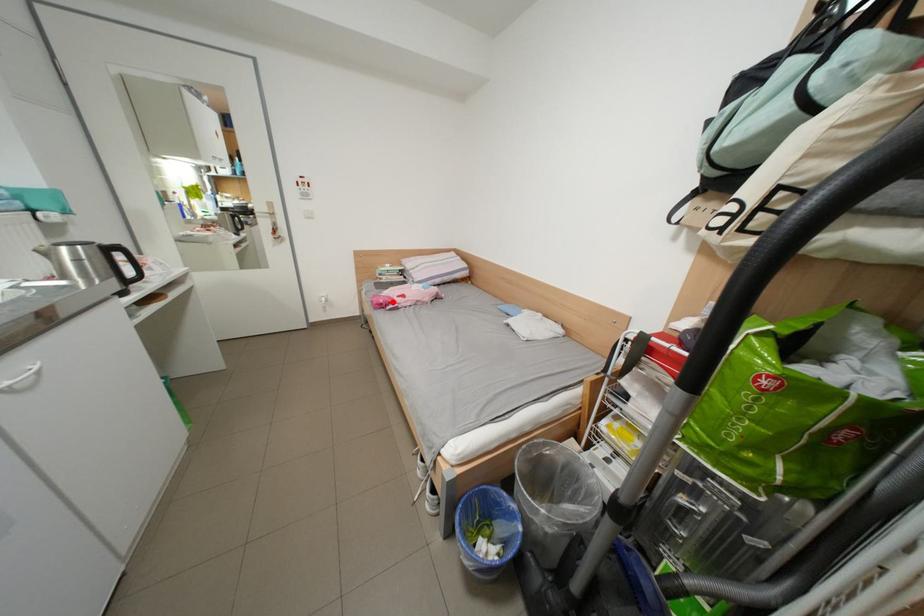
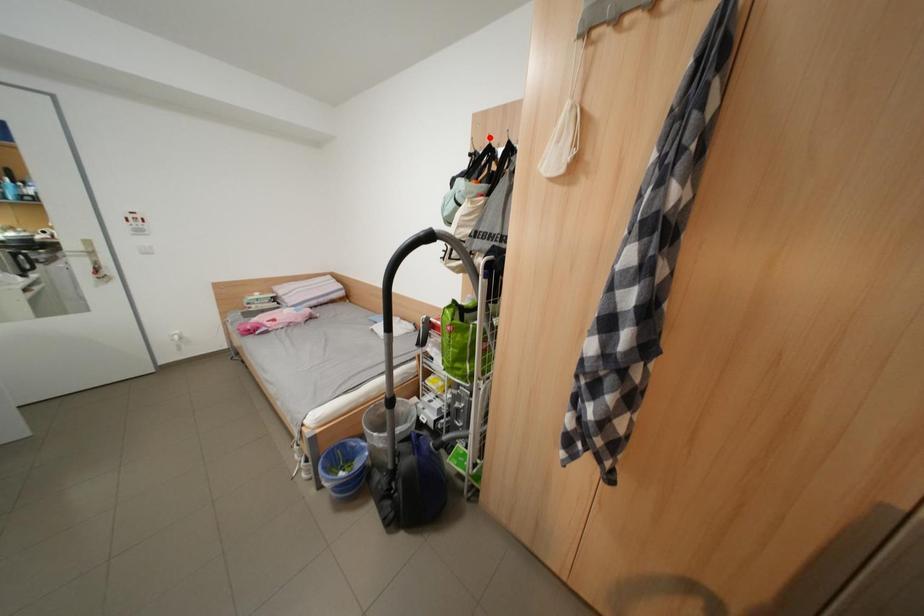
I am providing you with two images of the same scene from different viewpoints. A red point is marked on the first image and another point is marked on the second image. Is the marked point in image1 the same physical position as the marked point in image2?

No